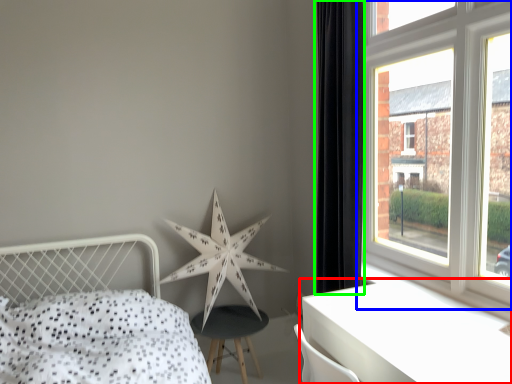
Question: Which is nearer to the table (highlighted by a red box)? window (highlighted by a blue box) or curtain (highlighted by a green box).

Choices:
 (A) window
 (B) curtain

Answer: (A)